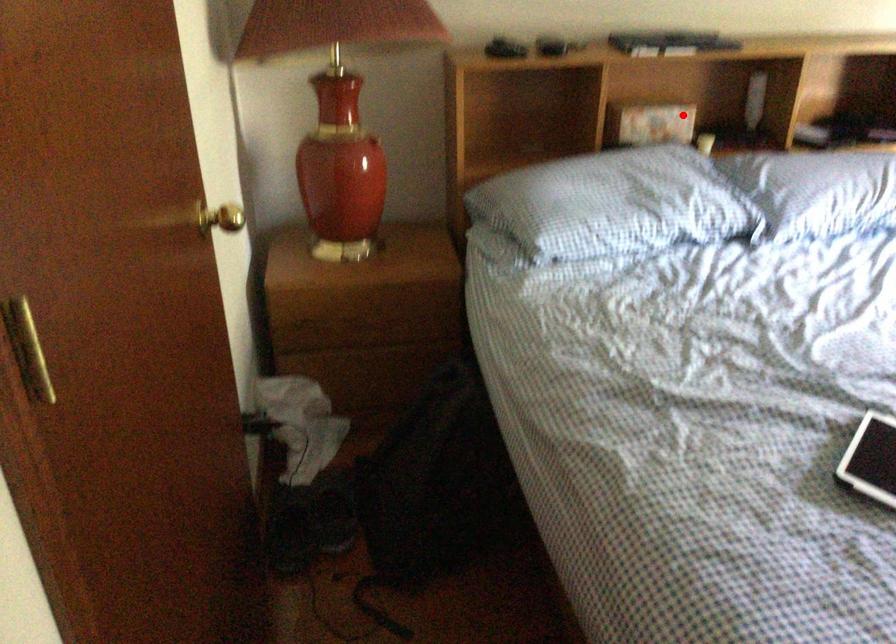
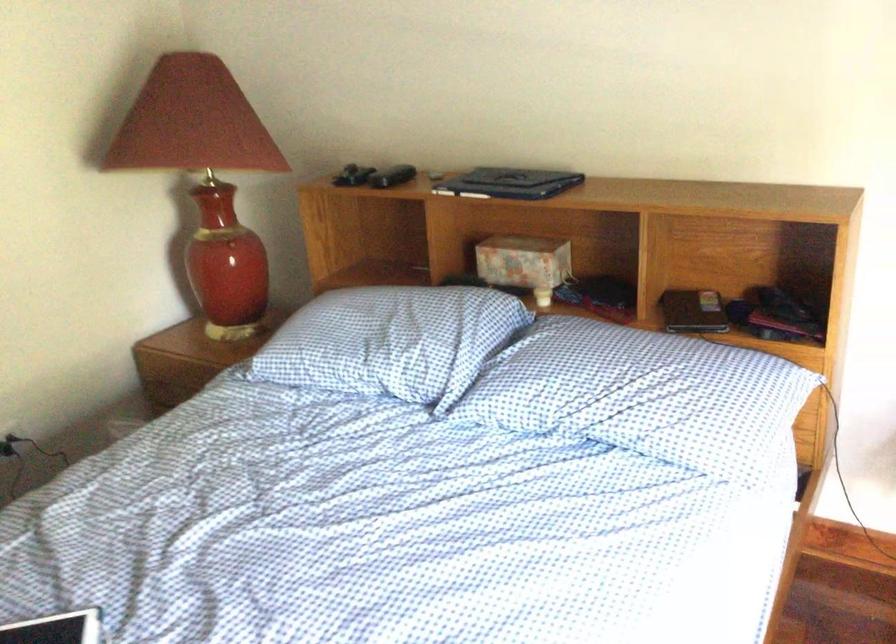
Question: I am providing you with two images of the same scene from different viewpoints. A red point is shown in image1. For the corresponding object point in image2, is it positioned nearer or farther from the camera?

Choices:
 (A) Nearer
 (B) Farther

Answer: (A)